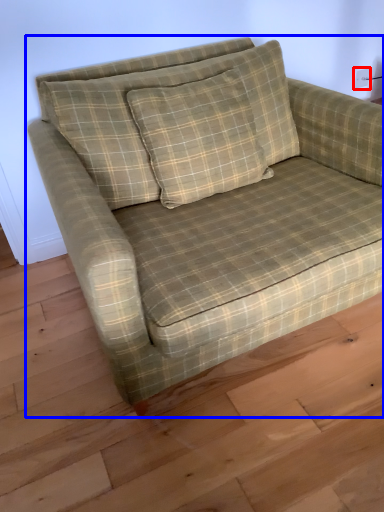
Question: Which object appears closest to the camera in this image, electric outlet (highlighted by a red box) or studio couch (highlighted by a blue box)?

Choices:
 (A) electric outlet
 (B) studio couch

Answer: (B)